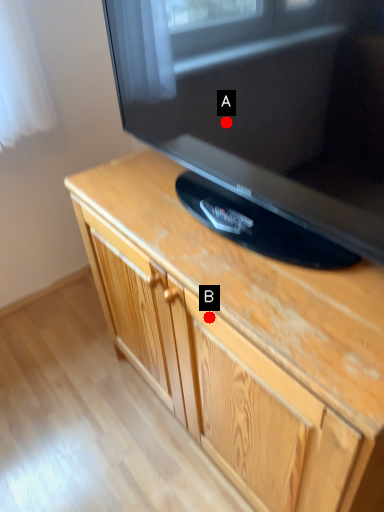
Question: Two points are circled on the image, labeled by A and B beside each circle. Which point is closer to the camera?

Choices:
 (A) A is closer
 (B) B is closer

Answer: (B)